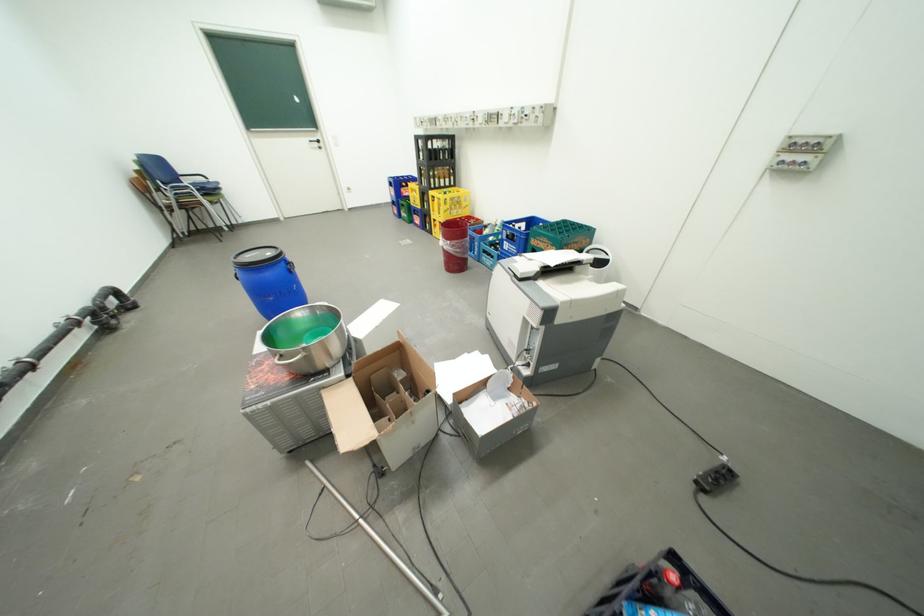
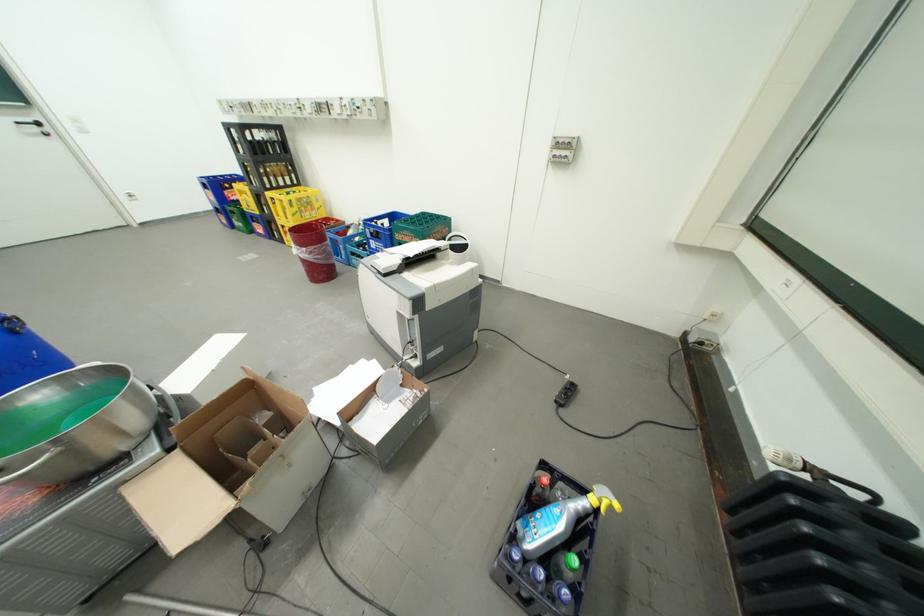
In the second image, find the point that corresponds to [523,382] in the first image.

(411, 377)